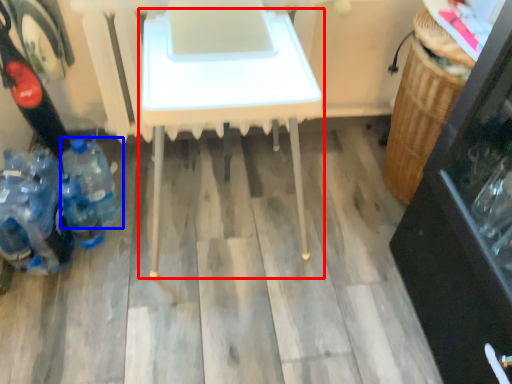
Question: Which object is further to the camera taking this photo, table (highlighted by a red box) or bottle (highlighted by a blue box)?

Choices:
 (A) table
 (B) bottle

Answer: (B)